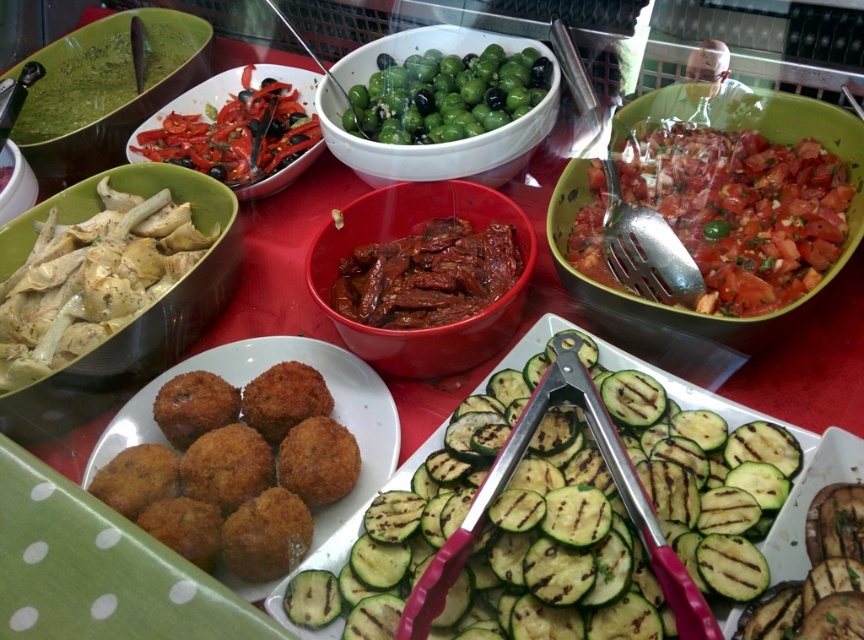
Question: Does grilled green zucchini at center appear under white creamy artichokes at left?

Choices:
 (A) yes
 (B) no

Answer: (A)

Question: Is white creamy artichokes at left positioned at the back of grilled zucchini at center?

Choices:
 (A) yes
 (B) no

Answer: (A)

Question: Which is nearer to the sliced red peppers at upper left?

Choices:
 (A) grilled green zucchini at center
 (B) white creamy artichokes at left
 (C) green matte olives at center
 (D) matte red bowl at center

Answer: (B)

Question: Considering the real-world distances, which object is farthest from the golden brown crispy croquettes at center?

Choices:
 (A) white creamy artichokes at left
 (B) chopped tomato salad at center right
 (C) sliced red peppers at upper left
 (D) grilled green zucchini at center

Answer: (C)

Question: Can you confirm if grilled green zucchini at center is thinner than green matte olives at center?

Choices:
 (A) no
 (B) yes

Answer: (A)

Question: Which of the following is the farthest from the observer?

Choices:
 (A) green matte olives at center
 (B) grilled green zucchini at center
 (C) golden brown crispy croquettes at center

Answer: (A)